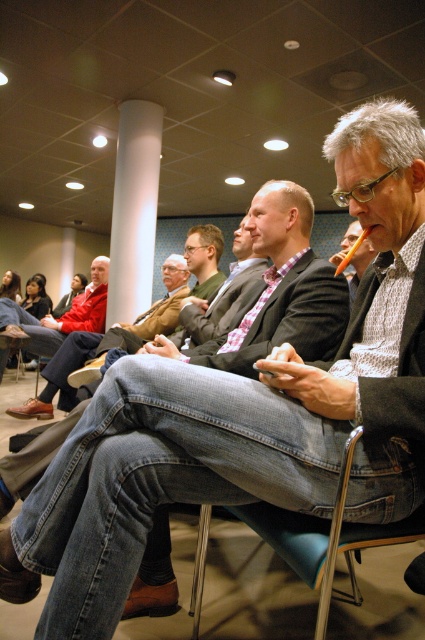
Does metallic blue chair at lower center have a greater height compared to red jacket at center?

No.

Is point (339, 506) less distant than point (19, 320)?

Yes, point (339, 506) is closer to viewer.

This screenshot has width=425, height=640. What do you see at coordinates (325, 540) in the screenshot?
I see `metallic blue chair at lower center` at bounding box center [325, 540].

Where is `metallic blue chair at lower center`? Image resolution: width=425 pixels, height=640 pixels. metallic blue chair at lower center is located at coordinates (325, 540).

Can you confirm if denim jeans at center is taller than red jacket at center?

Indeed, denim jeans at center has a greater height compared to red jacket at center.

Is denim jeans at center positioned behind red jacket at center?

No.

Which is behind, point (99, 339) or point (102, 266)?

The point (102, 266) is more distant.

Where is `denim jeans at center`? This screenshot has width=425, height=640. denim jeans at center is located at coordinates (61, 374).

Is point (95, 333) farther from camera compared to point (353, 294)?

That is True.

Can you confirm if denim jeans at center is positioned above matte black jacket at center?

Incorrect, denim jeans at center is not positioned above matte black jacket at center.

Is point (156, 310) farther from camera compared to point (353, 234)?

Yes.

You are a GUI agent. You are given a task and a screenshot of the screen. Output one action in this format:
    pyautogui.click(x=<x>, y=<y>)
    Task: Click on the denim jeans at center
    The height and width of the screenshot is (640, 425).
    Given the screenshot: What is the action you would take?
    pyautogui.click(x=61, y=374)